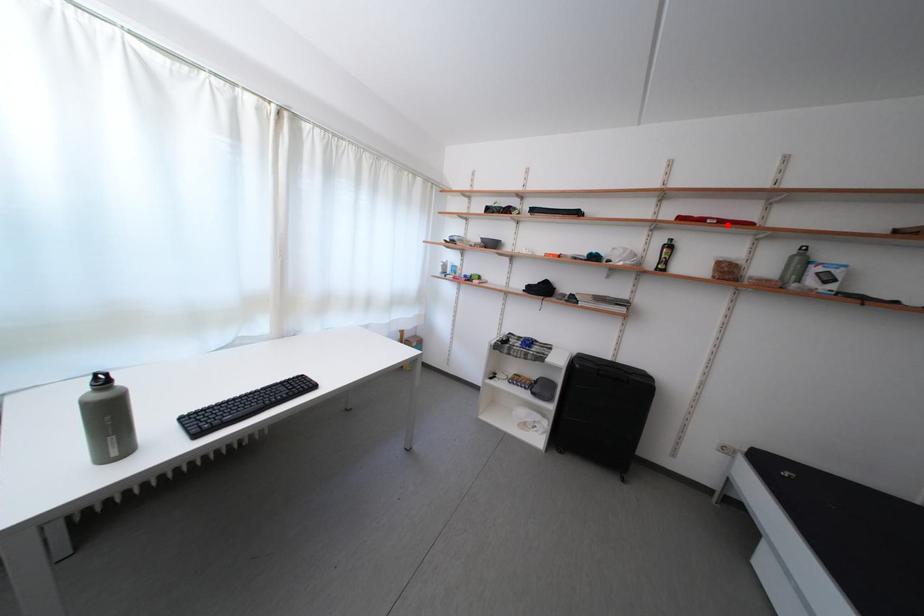
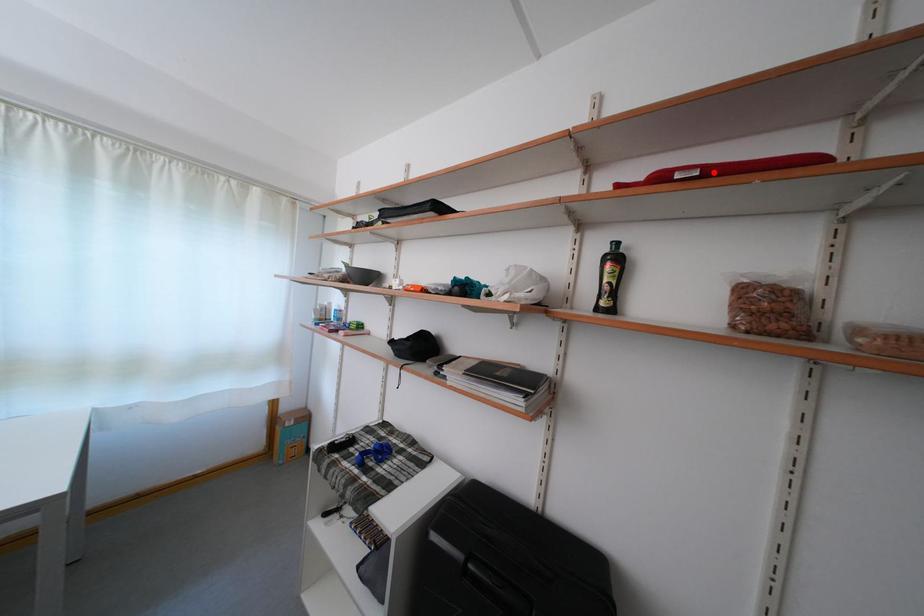
I am providing you with two images of the same scene from different viewpoints. A red point is marked on the first image and another point is marked on the second image. Do the highlighted points in image1 and image2 indicate the same real-world spot?

Yes